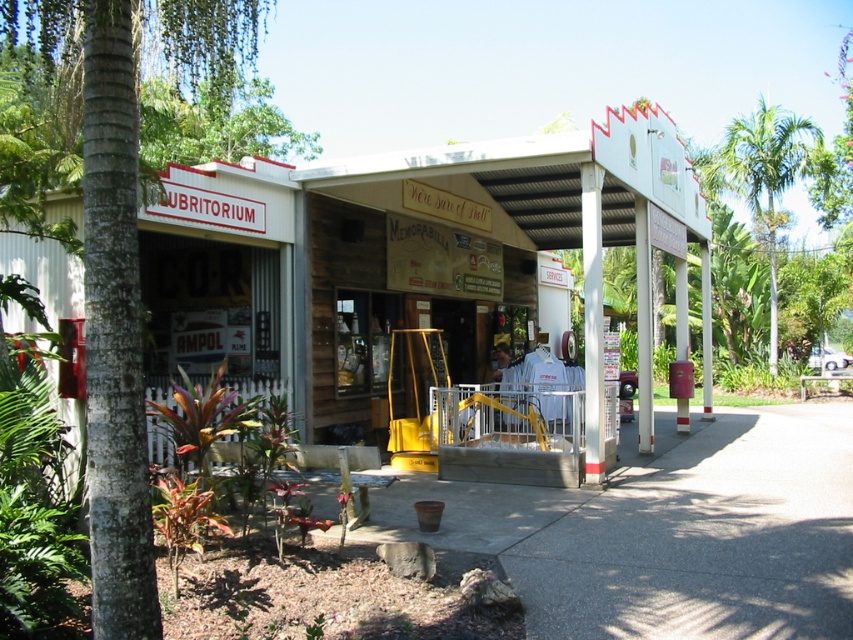
Who is more forward, (x=480, y=237) or (x=772, y=298)?

Point (x=480, y=237)

Does point (469, 196) lie in front of point (792, 138)?

Yes, it is in front of point (792, 138).

Identify the location of wooden signboard at center. The image size is (853, 640). (397, 252).